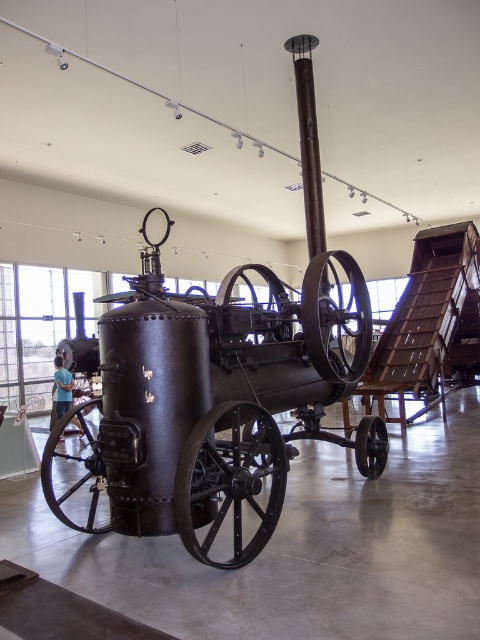
Does matte black steam engine at center have a lesser width compared to blue shirt at lower left?

No, matte black steam engine at center is not thinner than blue shirt at lower left.

You are a GUI agent. You are given a task and a screenshot of the screen. Output one action in this format:
    pyautogui.click(x=<x>, y=<y>)
    Task: Click on the matte black steam engine at center
    The image size is (480, 640).
    Given the screenshot: What is the action you would take?
    pyautogui.click(x=213, y=404)